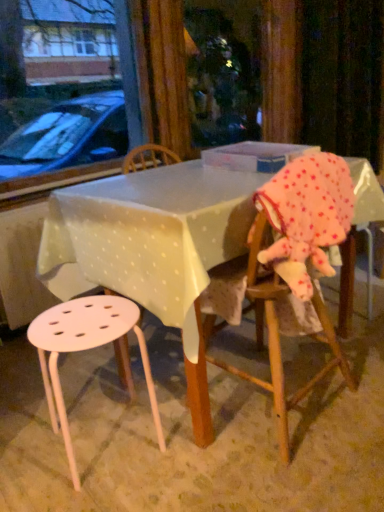
Question: Is wooden chair at right beside white plastic stool at lower left?

Choices:
 (A) no
 (B) yes

Answer: (A)

Question: Is wooden chair at right wider than white plastic stool at lower left?

Choices:
 (A) yes
 (B) no

Answer: (A)

Question: Does wooden chair at right have a lesser width compared to white plastic stool at lower left?

Choices:
 (A) no
 (B) yes

Answer: (A)

Question: Is wooden chair at right to the left of white plastic stool at lower left from the viewer's perspective?

Choices:
 (A) yes
 (B) no

Answer: (B)

Question: Is wooden chair at right positioned with its back to white plastic stool at lower left?

Choices:
 (A) no
 (B) yes

Answer: (A)

Question: From the image's perspective, is wooden chair at right beneath white plastic stool at lower left?

Choices:
 (A) yes
 (B) no

Answer: (B)

Question: Are pink polka dot fabric at right and white plastic stool at lower left located far from each other?

Choices:
 (A) yes
 (B) no

Answer: (B)

Question: Is pink polka dot fabric at right oriented towards white plastic stool at lower left?

Choices:
 (A) yes
 (B) no

Answer: (B)

Question: Is pink polka dot fabric at right behind white plastic stool at lower left?

Choices:
 (A) yes
 (B) no

Answer: (B)

Question: Is pink polka dot fabric at right positioned beyond the bounds of white plastic stool at lower left?

Choices:
 (A) yes
 (B) no

Answer: (A)

Question: Can you confirm if pink polka dot fabric at right is smaller than white plastic stool at lower left?

Choices:
 (A) yes
 (B) no

Answer: (A)

Question: Is the position of pink polka dot fabric at right less distant than that of white plastic stool at lower left?

Choices:
 (A) no
 (B) yes

Answer: (B)

Question: Is white plastic stool at lower left oriented away from white plastic table at center?

Choices:
 (A) yes
 (B) no

Answer: (A)